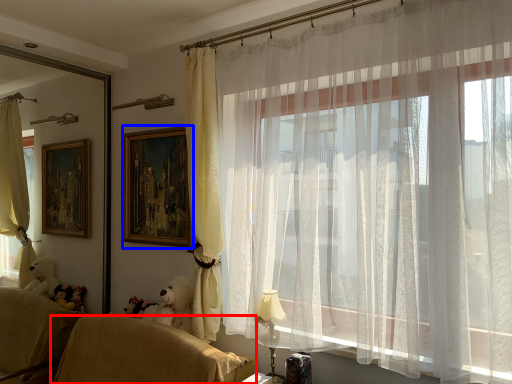
Question: Which object is closer to the camera taking this photo, furniture (highlighted by a red box) or picture frame (highlighted by a blue box)?

Choices:
 (A) furniture
 (B) picture frame

Answer: (A)